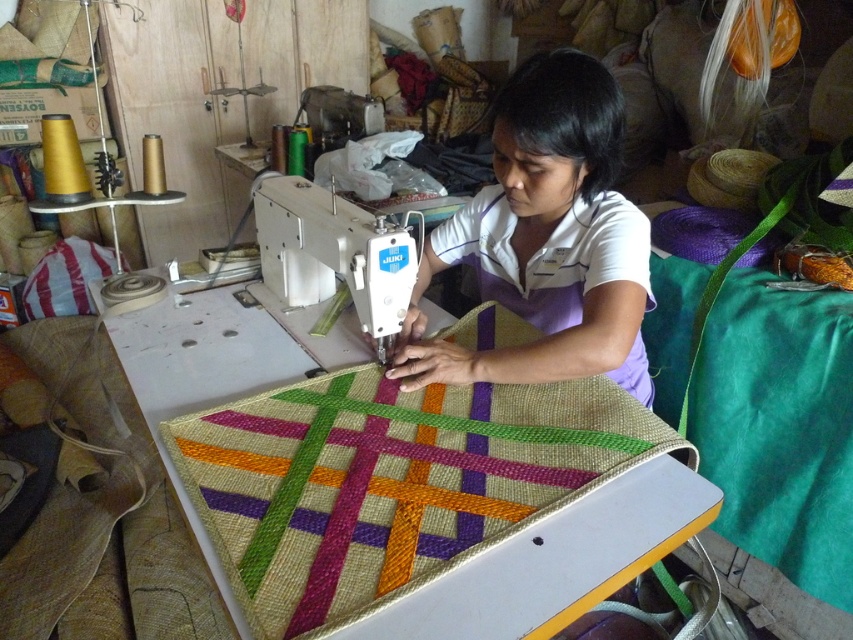
Who is higher up, woven fabric quilt at center or white cotton shirt at center?

white cotton shirt at center is higher up.

Is woven fabric quilt at center positioned behind white cotton shirt at center?

That is False.

Who is more distant from viewer, (440, 499) or (616, 362)?

Point (616, 362)

This screenshot has height=640, width=853. In order to click on woven fabric quilt at center in this screenshot , I will do `click(390, 483)`.

Who is shorter, woven fabric quilt at center or white plastic sewing machine at center?

white plastic sewing machine at center is shorter.

The height and width of the screenshot is (640, 853). What do you see at coordinates (390, 483) in the screenshot?
I see `woven fabric quilt at center` at bounding box center [390, 483].

What are the coordinates of `woven fabric quilt at center` in the screenshot? It's located at (390, 483).

Is point (578, 276) closer to camera compared to point (403, 253)?

No, it is behind (403, 253).

Who is more forward, [616,307] or [376,260]?

Point [376,260]

Where is `white cotton shirt at center`? The width and height of the screenshot is (853, 640). white cotton shirt at center is located at coordinates (546, 240).